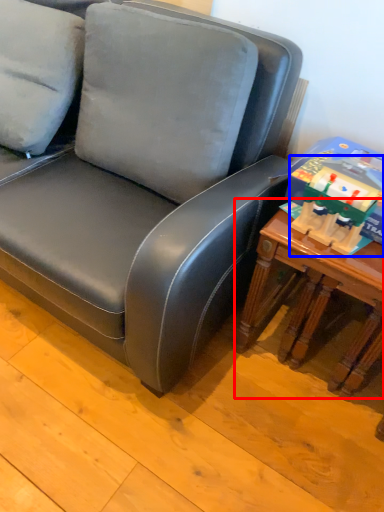
Question: Which point is closer to the camera, table (highlighted by a red box) or toy (highlighted by a blue box)?

Choices:
 (A) table
 (B) toy

Answer: (B)